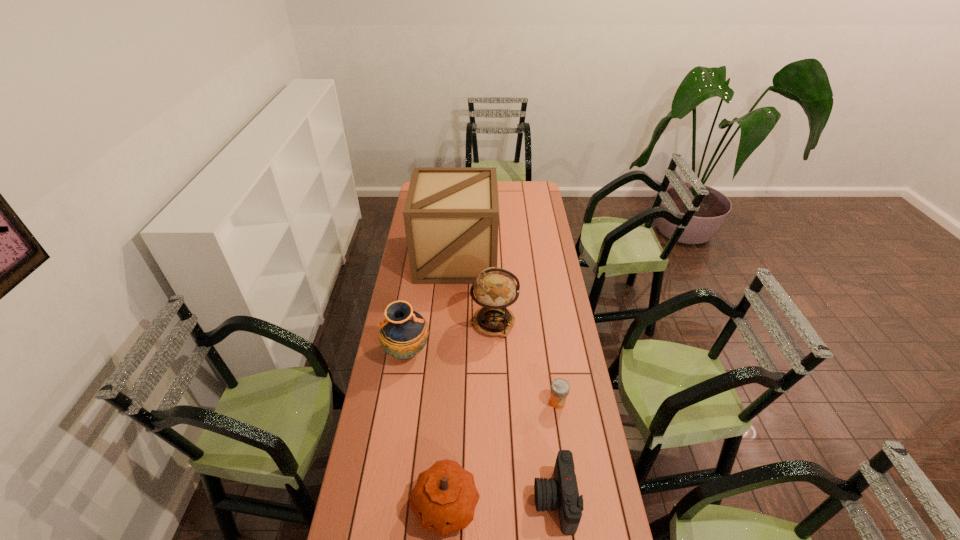
Image resolution: width=960 pixels, height=540 pixels. Identify the location of vacant space at the left edge of the desktop. click(405, 360).

Where is `free space at the right edge of the desktop`? The width and height of the screenshot is (960, 540). free space at the right edge of the desktop is located at coordinates (554, 253).

This screenshot has height=540, width=960. In the image, there is a desktop. Identify the location of free space at the far right corner. (524, 196).

I want to click on vacant area between the globe and the fifth tallest object, so click(524, 411).

Find the location of `vacant space in between the pottery and the fifth tallest object`. vacant space in between the pottery and the fifth tallest object is located at coordinates (481, 426).

This screenshot has height=540, width=960. Identify the location of unoccupied area between the fifth tallest object and the third tallest object. (481, 426).

Where is `vacant space that is in between the fourth shortest object and the third nearest object`? vacant space that is in between the fourth shortest object and the third nearest object is located at coordinates (482, 377).

This screenshot has height=540, width=960. In order to click on object that stands as the second closest to the camera in this screenshot , I will do `click(560, 388)`.

Locate which object ranks third in proximity to the shortest object. Please provide its 2D coordinates. Your answer should be formatted as a tuple, i.e. [(x, y)], where the tuple contains the x and y coordinates of a point satisfying the conditions above.

[(444, 498)]